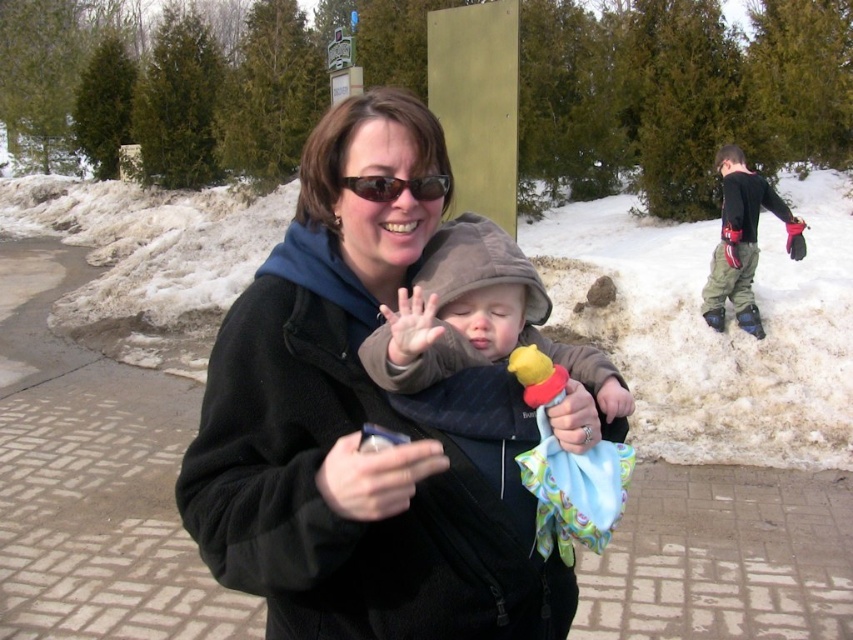
Question: Does black fleece jacket at center appear on the left side of black matte hand at center?

Choices:
 (A) yes
 (B) no

Answer: (B)

Question: Estimate the real-world distances between objects in this image. Which object is closer to the brown fleece jacket at center?

Choices:
 (A) black fleece jacket at center
 (B) dark green pants at right
 (C) black matte hand at center

Answer: (A)

Question: Considering the real-world distances, which object is farthest from the dark green pants at right?

Choices:
 (A) matte black sunglasses at center
 (B) black matte hand at center
 (C) black fleece jacket at center

Answer: (B)

Question: Is dark green pants at right wider than black matte hand at center?

Choices:
 (A) yes
 (B) no

Answer: (A)

Question: Is brown fleece jacket at center in front of black matte hand at center?

Choices:
 (A) no
 (B) yes

Answer: (A)

Question: Which point is closer to the camera taking this photo?

Choices:
 (A) (303, 435)
 (B) (518, 300)
 (C) (343, 452)
 (D) (709, 273)

Answer: (C)